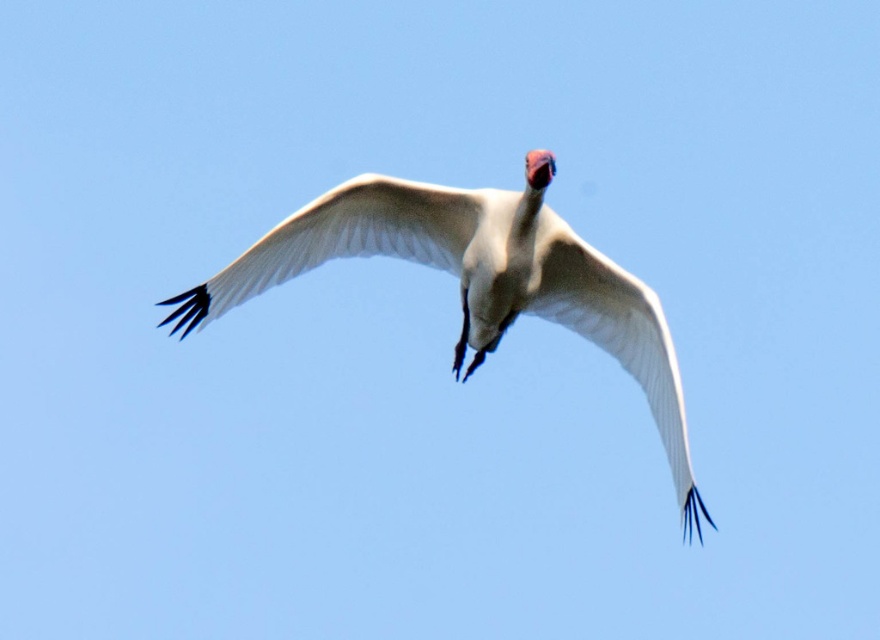
Question: Does white feathered bird at center have a lesser width compared to white feathered wing at center?

Choices:
 (A) yes
 (B) no

Answer: (B)

Question: In this image, where is white feathered bird at center located relative to white feathered wing at center?

Choices:
 (A) left
 (B) right

Answer: (B)

Question: Is the position of white feathered bird at center more distant than that of white feathered wing at center?

Choices:
 (A) yes
 (B) no

Answer: (B)

Question: Which object is farther from the camera taking this photo?

Choices:
 (A) white feathered wing at center
 (B) white feathered bird at center

Answer: (A)

Question: Which point is farther from the camera taking this photo?

Choices:
 (A) (453, 196)
 (B) (281, 227)

Answer: (B)